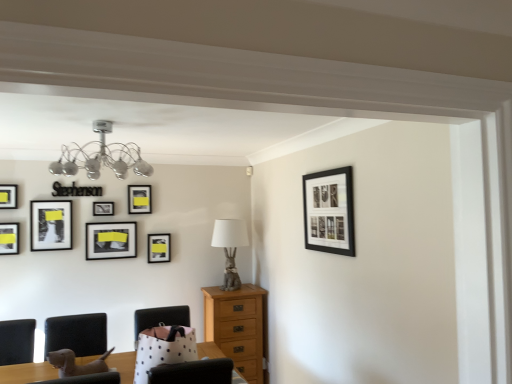
Question: Is matte black picture frame at upper left, arranged as the first picture frame when viewed from the left, not near matte black picture frame at left, which ranks as the third picture frame in left-to-right order?

Choices:
 (A) no
 (B) yes

Answer: (A)

Question: Considering the relative sizes of matte black picture frame at upper left, the 7th picture frame positioned from the back, and matte black picture frame at left, the fifth picture frame viewed from the back, in the image provided, is matte black picture frame at upper left, the 7th picture frame positioned from the back, thinner than matte black picture frame at left, the fifth picture frame viewed from the back,?

Choices:
 (A) no
 (B) yes

Answer: (B)

Question: From the image's perspective, is matte black picture frame at upper left, the 7th picture frame positioned from the back, located beneath matte black picture frame at left, marked as the 6th picture frame in a right-to-left arrangement?

Choices:
 (A) no
 (B) yes

Answer: (A)

Question: Can you confirm if matte black picture frame at upper left, the 2th picture frame in the front-to-back sequence, is shorter than matte black picture frame at left, which ranks as the third picture frame in left-to-right order?

Choices:
 (A) no
 (B) yes

Answer: (B)

Question: Is matte black picture frame at left, the 4th picture frame in the front-to-back sequence, completely or partially inside matte black picture frame at upper left, arranged as the first picture frame when viewed from the left?

Choices:
 (A) no
 (B) yes

Answer: (A)

Question: Is matte black picture frame at upper left, the 2th picture frame in the front-to-back sequence, closer to camera compared to matte black picture frame at left, marked as the 6th picture frame in a right-to-left arrangement?

Choices:
 (A) no
 (B) yes

Answer: (B)

Question: Can you confirm if white polka dot fabric armchair at center, which is the 1th armchair in right-to-left order, is shorter than matte black picture frame at upper left, the 7th picture frame positioned from the back?

Choices:
 (A) yes
 (B) no

Answer: (B)

Question: From the image's perspective, is white polka dot fabric armchair at center, acting as the 2th armchair starting from the left, over matte black picture frame at upper left, the 7th picture frame positioned from the back?

Choices:
 (A) yes
 (B) no

Answer: (B)

Question: From a real-world perspective, does white polka dot fabric armchair at center, which is the 1th armchair in right-to-left order, stand above matte black picture frame at upper left, positioned as the 8th picture frame in right-to-left order?

Choices:
 (A) no
 (B) yes

Answer: (A)

Question: Does white polka dot fabric armchair at center, which is the 1th armchair in right-to-left order, appear on the left side of matte black picture frame at upper left, the 2th picture frame in the front-to-back sequence?

Choices:
 (A) yes
 (B) no

Answer: (B)

Question: From a real-world perspective, is white polka dot fabric armchair at center, which is the 1th armchair in right-to-left order, located beneath matte black picture frame at upper left, the 2th picture frame in the front-to-back sequence?

Choices:
 (A) yes
 (B) no

Answer: (A)

Question: Does white polka dot fabric armchair at center, acting as the 2th armchair starting from the left, touch matte black picture frame at upper left, the 7th picture frame positioned from the back?

Choices:
 (A) no
 (B) yes

Answer: (A)

Question: From a real-world perspective, is chrome metallic chandelier at upper left below white polka dot fabric armchair at center, which is the 1th armchair in right-to-left order?

Choices:
 (A) yes
 (B) no

Answer: (B)